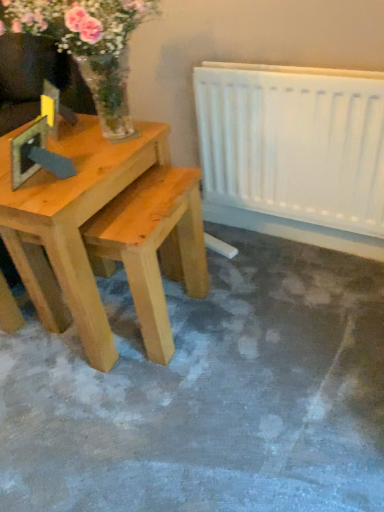
Question: Does translucent glass vase at upper left have a larger size compared to white plastic radiator at right?

Choices:
 (A) no
 (B) yes

Answer: (B)

Question: Is translucent glass vase at upper left aimed at white plastic radiator at right?

Choices:
 (A) no
 (B) yes

Answer: (A)

Question: Would you say translucent glass vase at upper left is outside white plastic radiator at right?

Choices:
 (A) no
 (B) yes

Answer: (B)

Question: Considering the relative positions of translucent glass vase at upper left and white plastic radiator at right in the image provided, is translucent glass vase at upper left behind white plastic radiator at right?

Choices:
 (A) no
 (B) yes

Answer: (A)

Question: Can you confirm if translucent glass vase at upper left is positioned to the left of white plastic radiator at right?

Choices:
 (A) no
 (B) yes

Answer: (B)

Question: Can you confirm if translucent glass vase at upper left is wider than white plastic radiator at right?

Choices:
 (A) no
 (B) yes

Answer: (B)

Question: Can you confirm if light brown wood table at left is taller than translucent glass vase at upper left?

Choices:
 (A) no
 (B) yes

Answer: (B)

Question: Considering the relative sizes of light brown wood table at left and translucent glass vase at upper left in the image provided, is light brown wood table at left bigger than translucent glass vase at upper left?

Choices:
 (A) yes
 (B) no

Answer: (A)

Question: Does light brown wood table at left have a smaller size compared to translucent glass vase at upper left?

Choices:
 (A) yes
 (B) no

Answer: (B)

Question: Is light brown wood table at left at the left side of translucent glass vase at upper left?

Choices:
 (A) no
 (B) yes

Answer: (B)

Question: From the image's perspective, is light brown wood table at left below translucent glass vase at upper left?

Choices:
 (A) no
 (B) yes

Answer: (B)

Question: Is light brown wood table at left not within translucent glass vase at upper left?

Choices:
 (A) yes
 (B) no

Answer: (A)

Question: From the image's perspective, is translucent glass vase at upper left over light brown wood table at left?

Choices:
 (A) yes
 (B) no

Answer: (A)